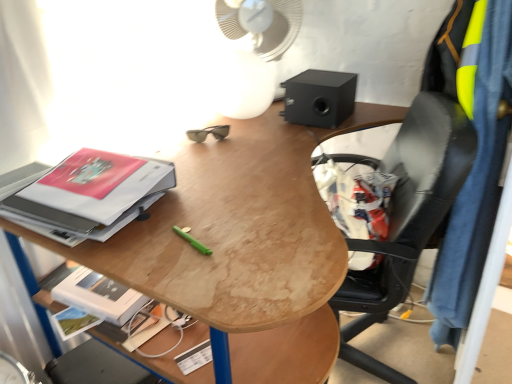
Question: Is wooden desk at center taller than white plastic mechanical fan at upper center?

Choices:
 (A) no
 (B) yes

Answer: (B)

Question: Does wooden desk at center contain white plastic mechanical fan at upper center?

Choices:
 (A) yes
 (B) no

Answer: (B)

Question: Is wooden desk at center shorter than white plastic mechanical fan at upper center?

Choices:
 (A) no
 (B) yes

Answer: (A)

Question: Is wooden desk at center not inside white plastic mechanical fan at upper center?

Choices:
 (A) no
 (B) yes

Answer: (B)

Question: Is wooden desk at center oriented towards white plastic mechanical fan at upper center?

Choices:
 (A) no
 (B) yes

Answer: (A)

Question: Can you confirm if wooden desk at center is thinner than white plastic mechanical fan at upper center?

Choices:
 (A) yes
 (B) no

Answer: (B)

Question: Is matte hardcover book at left at the back of wooden desk at center?

Choices:
 (A) no
 (B) yes

Answer: (A)

Question: From a real-world perspective, is wooden desk at center physically below matte hardcover book at left?

Choices:
 (A) yes
 (B) no

Answer: (A)

Question: Considering the relative positions of wooden desk at center and matte hardcover book at left in the image provided, is wooden desk at center behind matte hardcover book at left?

Choices:
 (A) no
 (B) yes

Answer: (A)

Question: Considering the relative sizes of wooden desk at center and matte hardcover book at left in the image provided, is wooden desk at center shorter than matte hardcover book at left?

Choices:
 (A) yes
 (B) no

Answer: (B)

Question: Does wooden desk at center turn towards matte hardcover book at left?

Choices:
 (A) yes
 (B) no

Answer: (B)

Question: Considering the relative sizes of wooden desk at center and matte hardcover book at left in the image provided, is wooden desk at center smaller than matte hardcover book at left?

Choices:
 (A) no
 (B) yes

Answer: (A)

Question: Is black matte speaker at upper right positioned before wooden desk at center?

Choices:
 (A) no
 (B) yes

Answer: (A)